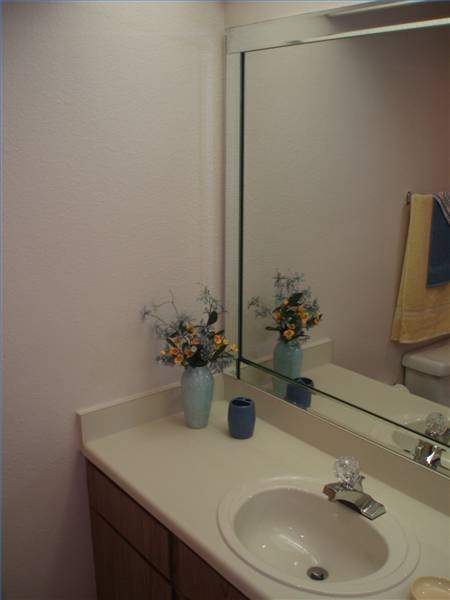
Identify the location of vase. tap(196, 398).